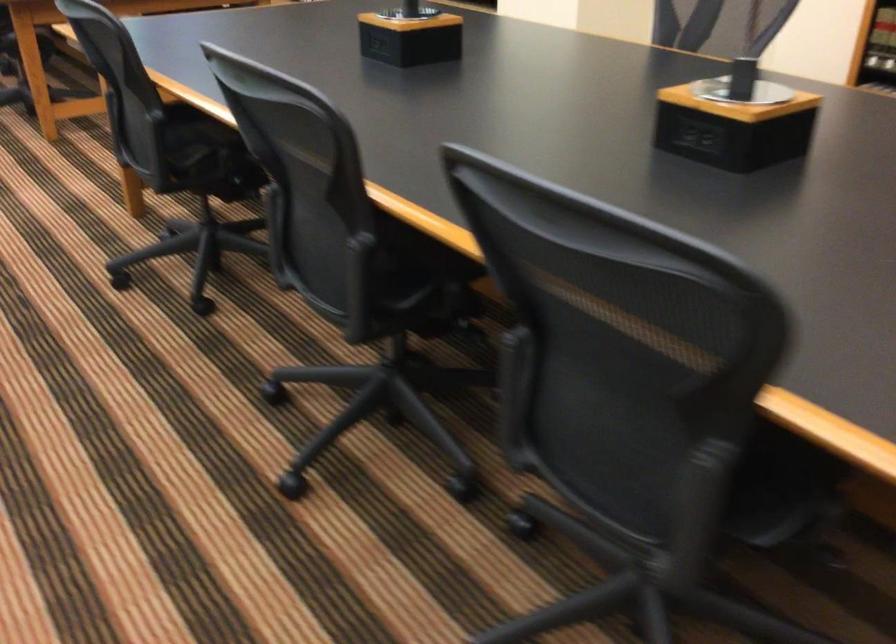
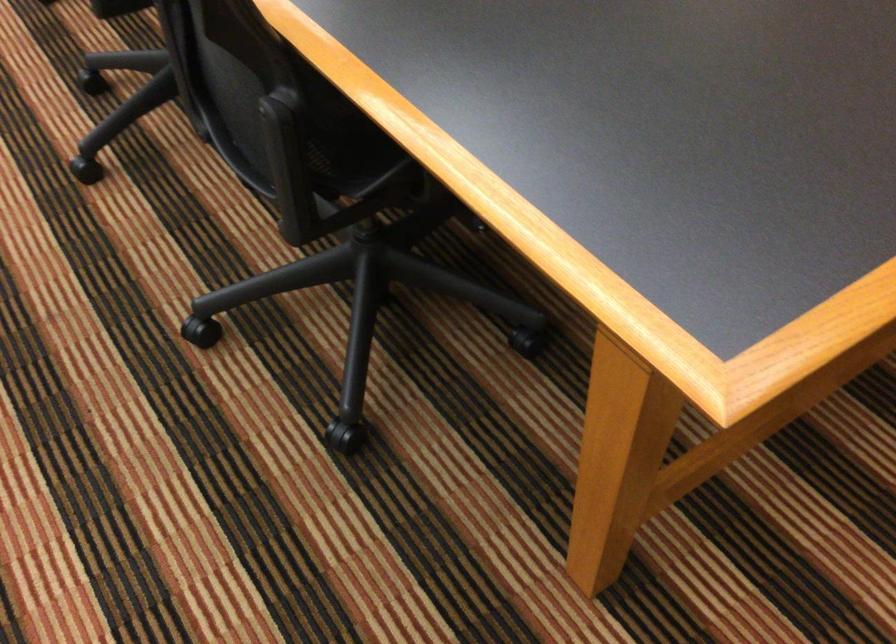
Find the pixel in the second image that matches (280,399) in the first image.

(91, 82)